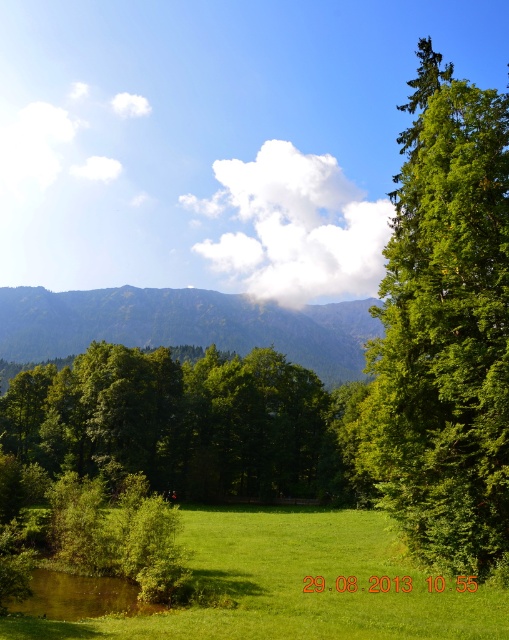
You are standing at the edge of the green grassy field at lower center and want to reach the green forested mountain at center. Which direction should you move to get closer to the mountain?

You should move forward towards the green forested mountain at center because the green grassy field at lower center is in front of it, meaning the mountain is behind the field from your current position.

You are planning to plant a new tree in this landscape. The green leafy tree at right and the green forested mountain at center are both visible from your proposed planting spot. Which object will appear larger in your view?

The green leafy tree at right will appear larger in your view because it is bigger than the green forested mountain at center.